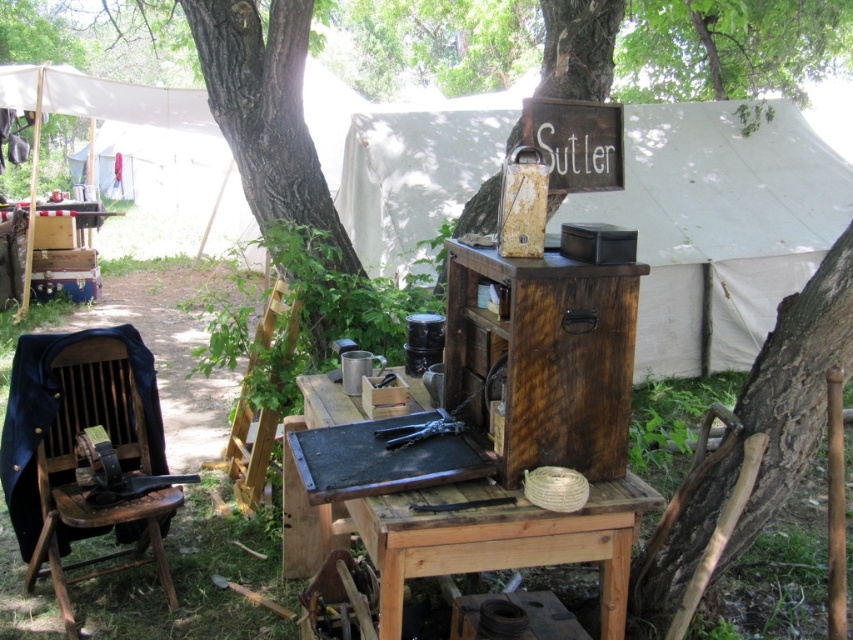
Question: Does wooden crate at center have a larger size compared to rustic wood picnic table at center?

Choices:
 (A) yes
 (B) no

Answer: (A)

Question: Which object is farther from the camera taking this photo?

Choices:
 (A) brown rough bark tree at center
 (B) rustic wood picnic table at center
 (C) dark brown wood at lower right

Answer: (A)

Question: Which object is closer to the camera taking this photo?

Choices:
 (A) wooden crate at center
 (B) brown rough bark tree at center

Answer: (B)

Question: Is dark brown wood at lower right bigger than brown rough bark tree at center?

Choices:
 (A) yes
 (B) no

Answer: (B)

Question: Is rustic wood picnic table at center smaller than dark brown wood at lower right?

Choices:
 (A) no
 (B) yes

Answer: (B)

Question: Which point is closer to the camera taking this photo?

Choices:
 (A) (405, 540)
 (B) (625, 186)

Answer: (A)